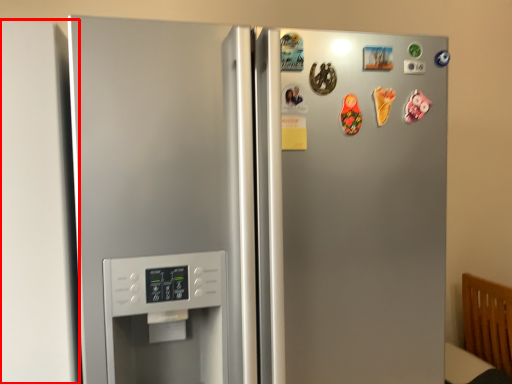
Question: From the image's perspective, where is door (annotated by the red box) located in relation to refrigerator in the image?

Choices:
 (A) below
 (B) above

Answer: (B)